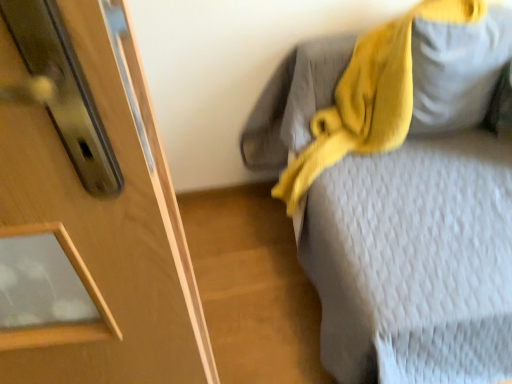
Question: In the image, is matte gray pillow at upper right positioned in front of or behind textured gray bed at upper right?

Choices:
 (A) front
 (B) behind

Answer: (B)

Question: Would you say matte gray pillow at upper right is inside or outside textured gray bed at upper right?

Choices:
 (A) inside
 (B) outside

Answer: (A)

Question: Considering the real-world distances, which object is farthest from the textured gray bed at upper right?

Choices:
 (A) matte gray pillow at upper right
 (B) yellow knitted scarf at upper right

Answer: (A)

Question: Estimate the real-world distances between objects in this image. Which object is closer to the yellow knitted scarf at upper right?

Choices:
 (A) textured gray bed at upper right
 (B) matte gray pillow at upper right

Answer: (B)